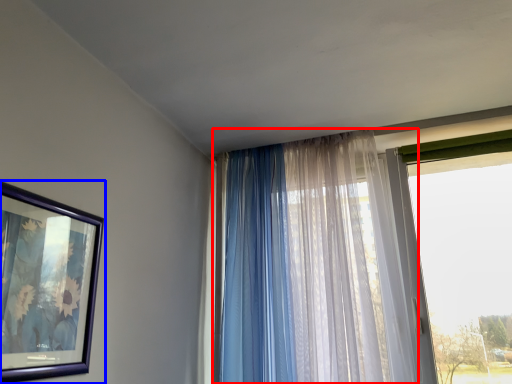
Question: Which object is further to the camera taking this photo, curtain (highlighted by a red box) or picture frame (highlighted by a blue box)?

Choices:
 (A) curtain
 (B) picture frame

Answer: (A)